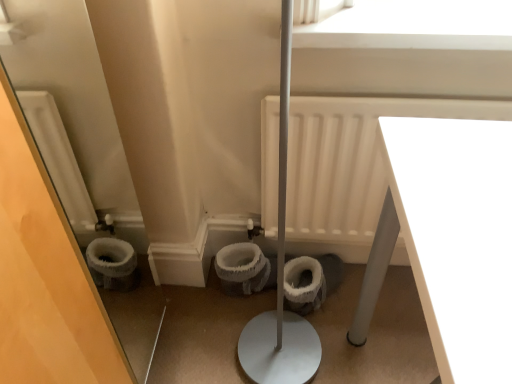
Question: Is white matte window screen at upper center smaller than white glossy table at lower right?

Choices:
 (A) yes
 (B) no

Answer: (A)

Question: Is white matte window screen at upper center located outside white glossy table at lower right?

Choices:
 (A) no
 (B) yes

Answer: (B)

Question: Is white matte window screen at upper center bigger than white glossy table at lower right?

Choices:
 (A) no
 (B) yes

Answer: (A)

Question: Is white matte window screen at upper center at the left side of white glossy table at lower right?

Choices:
 (A) no
 (B) yes

Answer: (B)

Question: Is white matte window screen at upper center aimed at white glossy table at lower right?

Choices:
 (A) no
 (B) yes

Answer: (A)

Question: Does white matte window screen at upper center have a lesser height compared to white glossy table at lower right?

Choices:
 (A) no
 (B) yes

Answer: (B)

Question: Is white matte radiator at center positioned behind white fuzzy toilet bowl at center, placed as the second toilet bowl when sorted from right to left?

Choices:
 (A) yes
 (B) no

Answer: (B)

Question: From a real-world perspective, is white matte radiator at center physically above white fuzzy toilet bowl at center, placed as the second toilet bowl when sorted from right to left?

Choices:
 (A) no
 (B) yes

Answer: (B)

Question: From the image's perspective, is white matte radiator at center above white fuzzy toilet bowl at center, which is the 1th toilet bowl from left to right?

Choices:
 (A) no
 (B) yes

Answer: (B)

Question: Can we say white matte radiator at center lies outside white fuzzy toilet bowl at center, which is the 1th toilet bowl from left to right?

Choices:
 (A) no
 (B) yes

Answer: (B)

Question: Can you confirm if white matte radiator at center is positioned to the left of white fuzzy toilet bowl at center, which is the 1th toilet bowl from left to right?

Choices:
 (A) yes
 (B) no

Answer: (B)

Question: Is white matte radiator at center wider than white fuzzy toilet bowl at center, placed as the second toilet bowl when sorted from right to left?

Choices:
 (A) yes
 (B) no

Answer: (A)

Question: Considering the relative positions of white fuzzy toilet bowl at center, which is the 1th toilet bowl from left to right, and white glossy table at lower right in the image provided, is white fuzzy toilet bowl at center, which is the 1th toilet bowl from left to right, behind white glossy table at lower right?

Choices:
 (A) no
 (B) yes

Answer: (B)